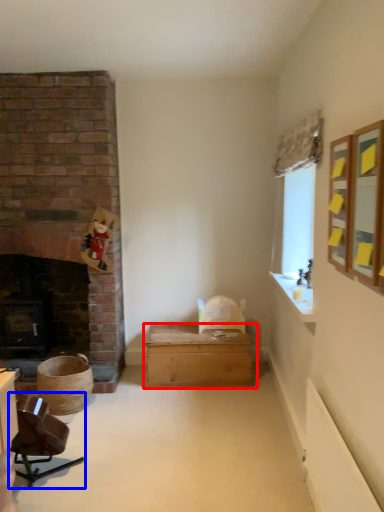
Question: Which object appears closest to the camera in this image, table (highlighted by a red box) or chair (highlighted by a blue box)?

Choices:
 (A) table
 (B) chair

Answer: (B)